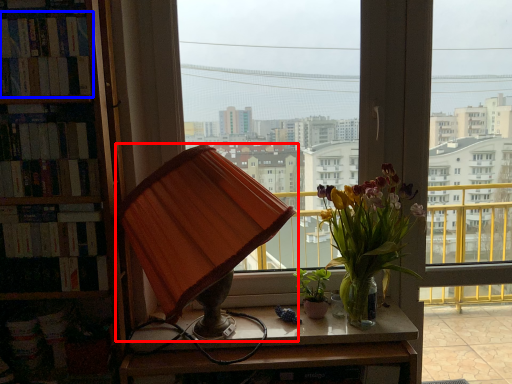
Question: Which object appears farthest to the camera in this image, lamp (highlighted by a red box) or book (highlighted by a blue box)?

Choices:
 (A) lamp
 (B) book

Answer: (B)